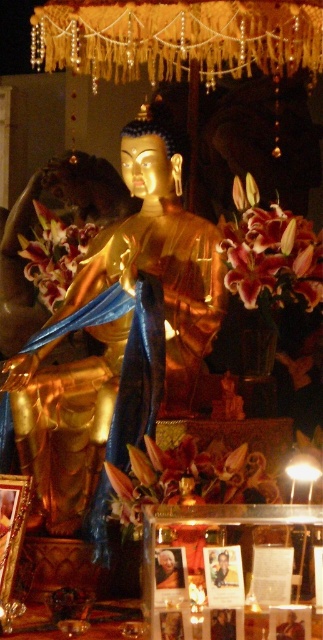
You are a visitor standing in front of the gold polished statue at center and the pink lily at left. If you want to place a new offering closer to the statue, where should you put it?

Since the gold polished statue at center is closer to the viewer than the pink lily at left, you should place the offering between yourself and the statue to ensure it is closer to the statue.

You are a visitor standing in front of the gold polished statue at center and the pink silk lily at center. Which object is positioned higher in the scene?

The pink silk lily at center is positioned higher than the gold polished statue at center.